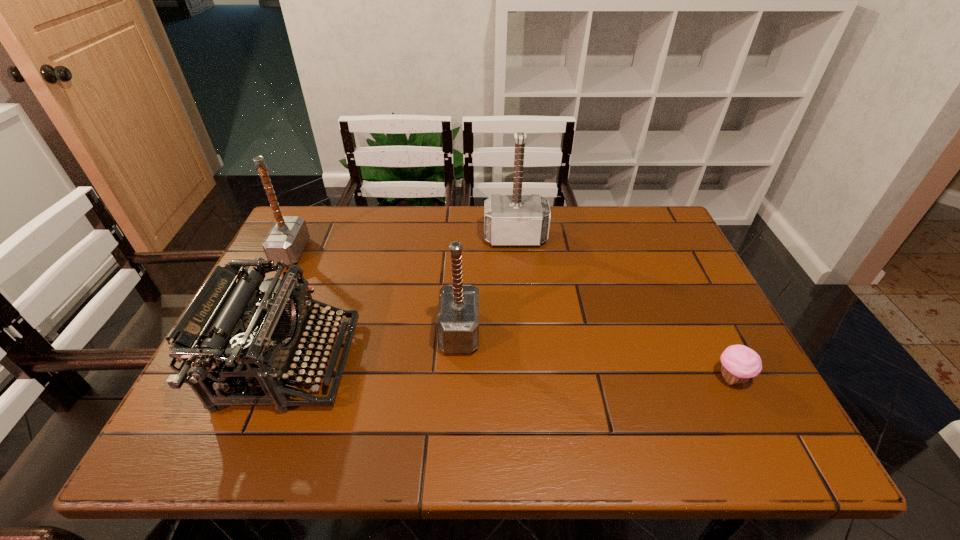
Identify the location of vacant region between the leftmost hammer and the fourth object from left to right. (403, 245).

The width and height of the screenshot is (960, 540). In order to click on free spot between the leftmost hammer and the fourth object from left to right in this screenshot , I will do `click(403, 245)`.

At what (x,y) coordinates should I click in order to perform the action: click on the third closest object relative to the leftmost hammer. Please return your answer as a coordinate pair (x, y). Looking at the image, I should click on (509, 220).

Identify which object is located as the fourth nearest to the shortest object. Please provide its 2D coordinates. Your answer should be formatted as a tuple, i.e. [(x, y)], where the tuple contains the x and y coordinates of a point satisfying the conditions above.

[(287, 238)]

This screenshot has height=540, width=960. Identify the location of hammer object that ranks as the second closest to the second shortest object. (457, 324).

The width and height of the screenshot is (960, 540). In order to click on the closest hammer to the leftmost hammer in this screenshot , I will do `click(457, 324)`.

You are a GUI agent. You are given a task and a screenshot of the screen. Output one action in this format:
    pyautogui.click(x=<x>, y=<y>)
    Task: Click on the vacant space that satisfies the following two spatial constraints: 1. for striking with the head of the fourth object from left to right; 2. on the right side of the cupcake
    Image resolution: width=960 pixels, height=540 pixels.
    Given the screenshot: What is the action you would take?
    (529, 378)

Locate an element on the screen. vacant region that satisfies the following two spatial constraints: 1. for striking with the head of the rightmost hammer; 2. on the typing side of the typewriter is located at coordinates (527, 362).

Where is `free spot that satisfies the following two spatial constraints: 1. on the typing side of the fourth tallest object; 2. on the left side of the shortest object`? free spot that satisfies the following two spatial constraints: 1. on the typing side of the fourth tallest object; 2. on the left side of the shortest object is located at coordinates [283, 378].

Image resolution: width=960 pixels, height=540 pixels. I want to click on free space that satisfies the following two spatial constraints: 1. on the typing side of the fourth tallest object; 2. on the right side of the shortest object, so click(x=283, y=378).